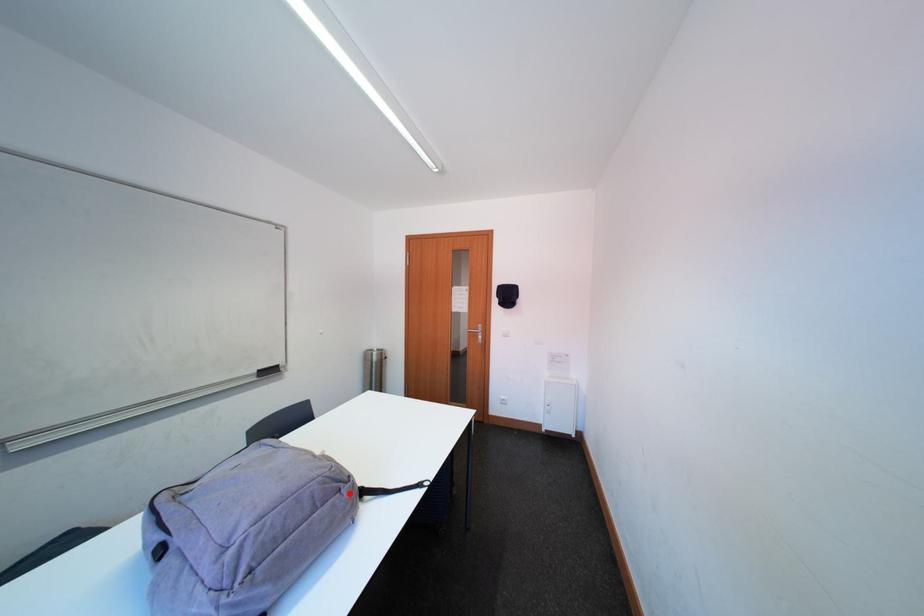
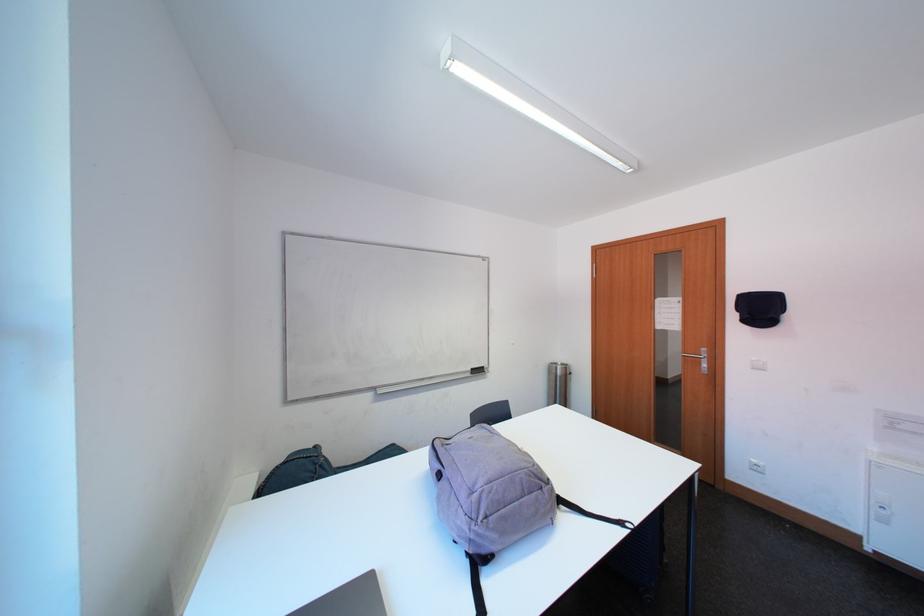
Where in the second image is the point corresponding to the highlighted location from the first image?

(551, 492)